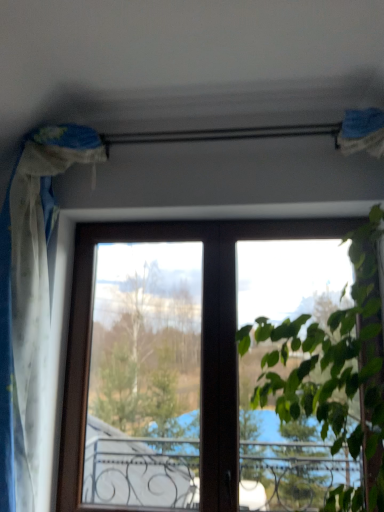
Question: Does green leafy plant at upper right have a smaller size compared to white sheer curtain at left?

Choices:
 (A) no
 (B) yes

Answer: (A)

Question: Does green leafy plant at upper right appear on the right side of white sheer curtain at left?

Choices:
 (A) yes
 (B) no

Answer: (A)

Question: Considering the relative sizes of green leafy plant at upper right and white sheer curtain at left in the image provided, is green leafy plant at upper right shorter than white sheer curtain at left?

Choices:
 (A) yes
 (B) no

Answer: (A)

Question: From the image's perspective, is green leafy plant at upper right above white sheer curtain at left?

Choices:
 (A) yes
 (B) no

Answer: (B)

Question: From a real-world perspective, does green leafy plant at upper right sit lower than white sheer curtain at left?

Choices:
 (A) no
 (B) yes

Answer: (B)

Question: Is green leafy plant at upper right not close to white sheer curtain at left?

Choices:
 (A) no
 (B) yes

Answer: (B)

Question: Does white sheer curtain at left have a lesser height compared to green leafy plant at upper right?

Choices:
 (A) yes
 (B) no

Answer: (B)

Question: Is white sheer curtain at left turned away from green leafy plant at upper right?

Choices:
 (A) no
 (B) yes

Answer: (A)

Question: Can you confirm if white sheer curtain at left is bigger than green leafy plant at upper right?

Choices:
 (A) yes
 (B) no

Answer: (B)

Question: From the image's perspective, would you say white sheer curtain at left is positioned over green leafy plant at upper right?

Choices:
 (A) yes
 (B) no

Answer: (A)

Question: Is white sheer curtain at left touching green leafy plant at upper right?

Choices:
 (A) no
 (B) yes

Answer: (A)

Question: Is white sheer curtain at left positioned in front of green leafy plant at upper right?

Choices:
 (A) yes
 (B) no

Answer: (B)

Question: In terms of size, does white sheer curtain at left appear bigger or smaller than green leafy plant at upper right?

Choices:
 (A) big
 (B) small

Answer: (B)